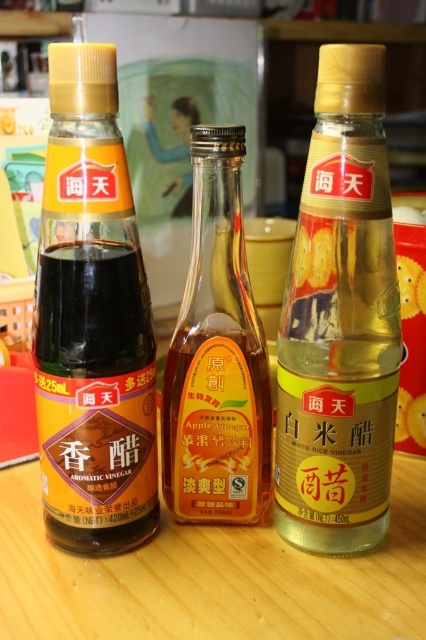
Question: Which point is closer to the camera?

Choices:
 (A) yellow translucent bottle at center
 (B) translucent glass bottle at center

Answer: (A)

Question: Does matte black bottle at left have a larger size compared to translucent glass bottle at center?

Choices:
 (A) yes
 (B) no

Answer: (A)

Question: Which is farther from the yellow translucent bottle at center?

Choices:
 (A) matte black bottle at left
 (B) translucent glass bottle at center

Answer: (A)

Question: Based on their relative distances, which object is farther from the translucent glass bottle at center?

Choices:
 (A) yellow translucent bottle at center
 (B) matte black bottle at left

Answer: (B)

Question: Is matte black bottle at left closer to the viewer compared to translucent glass bottle at center?

Choices:
 (A) no
 (B) yes

Answer: (B)

Question: In this image, where is matte black bottle at left located relative to translucent glass bottle at center?

Choices:
 (A) left
 (B) right

Answer: (A)